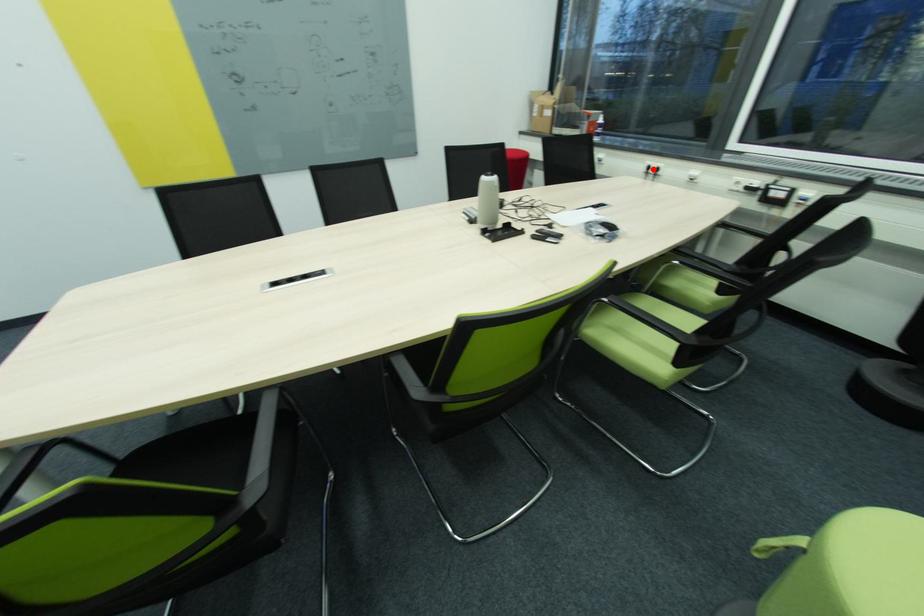
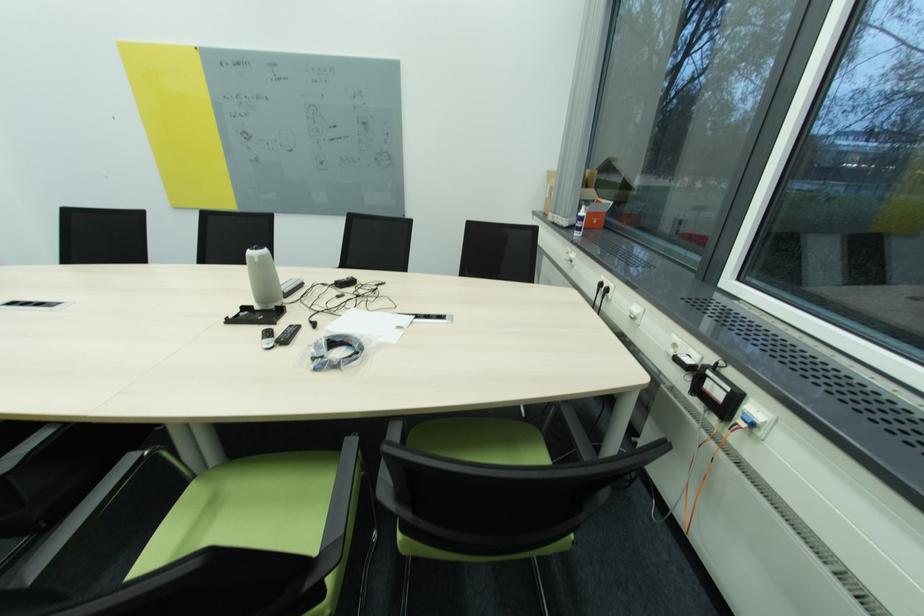
Where in the second image is the point corresponding to the highlighted location from the first image?

(604, 286)